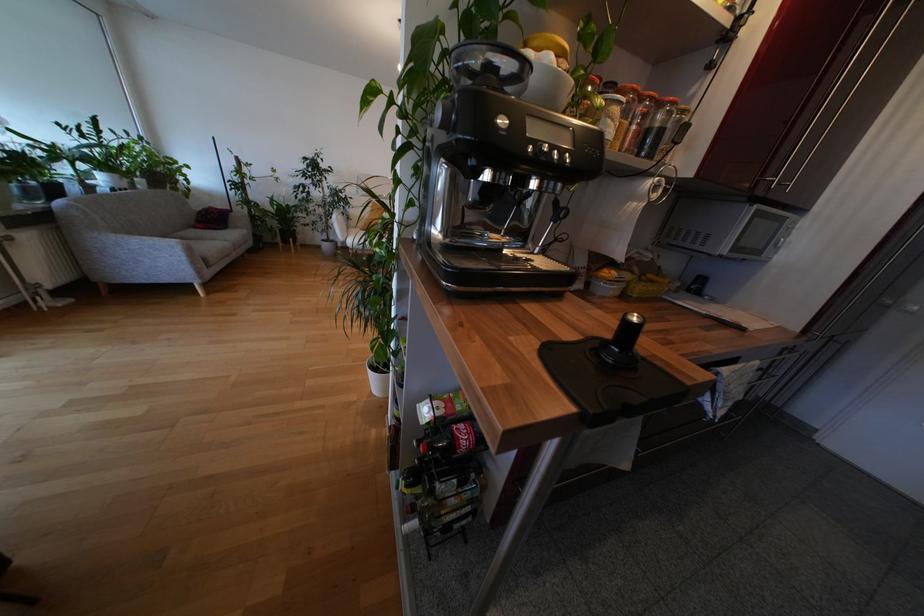
You are a GUI agent. You are given a task and a screenshot of the screen. Output one action in this format:
    pyautogui.click(x=<x>, y=<y>)
    Task: Click on the metal cabinet handle
    This screenshot has height=616, width=924.
    Given the screenshot: What is the action you would take?
    pyautogui.click(x=831, y=94)